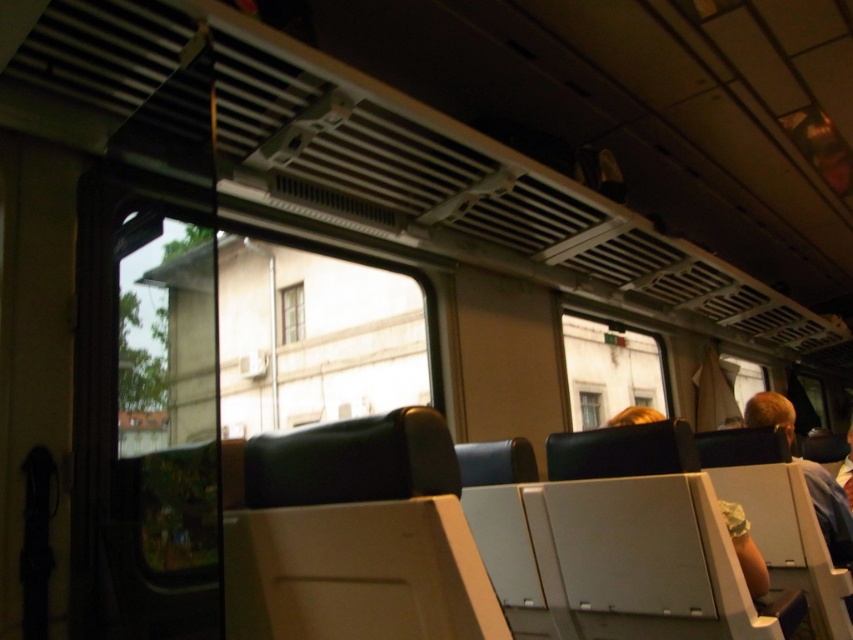
Question: Does light brown hair at right have a smaller size compared to clear glass window at center?

Choices:
 (A) yes
 (B) no

Answer: (A)

Question: Which object is closer to the camera taking this photo?

Choices:
 (A) light brown hair at right
 (B) white wooden window at center

Answer: (A)

Question: In this image, where is light brown hair at right located relative to clear glass window at center?

Choices:
 (A) right
 (B) left

Answer: (B)

Question: Which object appears farthest from the camera in this image?

Choices:
 (A) light brown leather armrest at center
 (B) white wooden window at center

Answer: (B)

Question: Which of the following is the closest to the observer?

Choices:
 (A) (728, 520)
 (B) (282, 316)
 (C) (834, 506)

Answer: (A)

Question: Is light brown leather armrest at center wider than white wooden window at center?

Choices:
 (A) yes
 (B) no

Answer: (B)